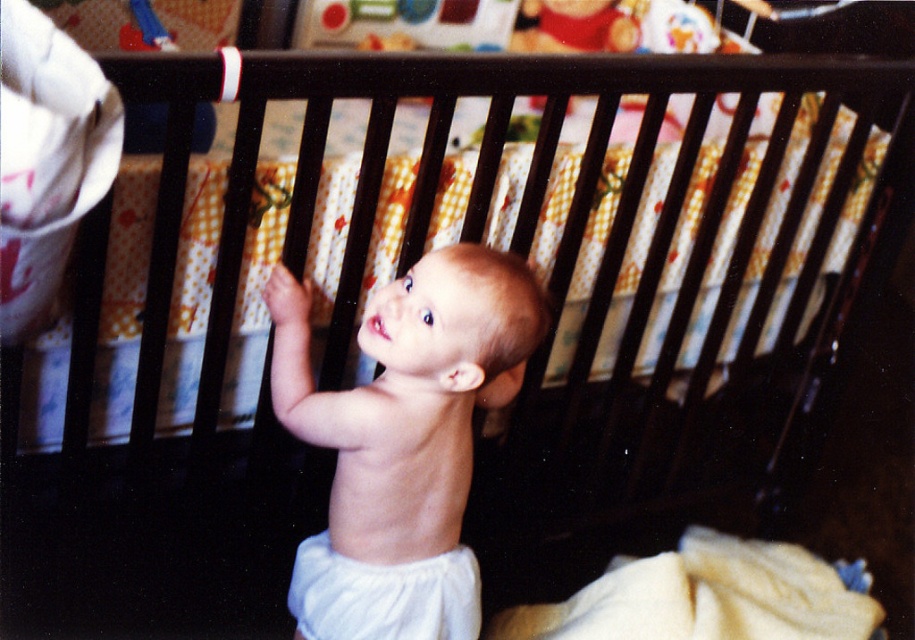
Is smooth white diaper at center shorter than white cloth diaper at center?

No, smooth white diaper at center is not shorter than white cloth diaper at center.

Is point (330, 435) closer to camera compared to point (472, 605)?

Yes, point (330, 435) is in front of point (472, 605).

Where is `smooth white diaper at center`? smooth white diaper at center is located at coordinates (408, 396).